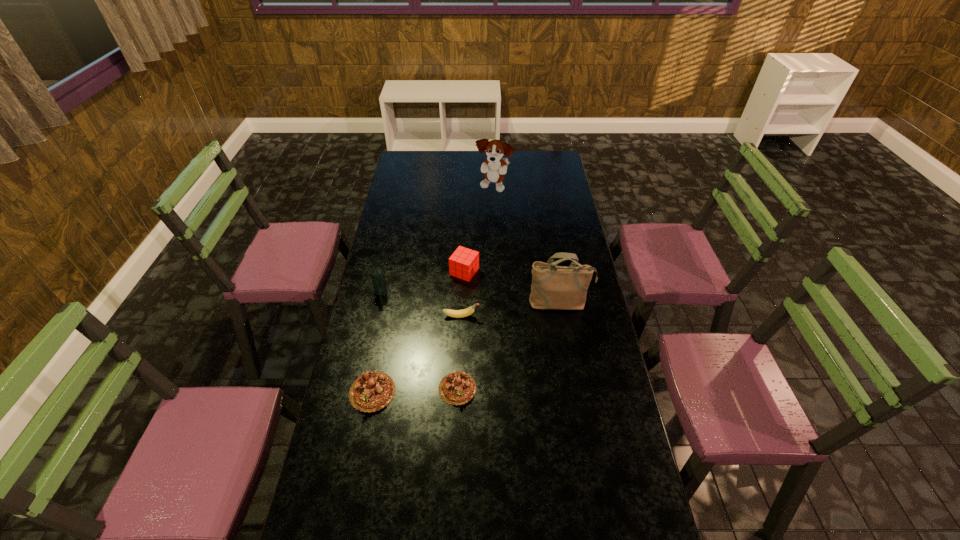
Where is `blank space at the near edge of the desktop`? blank space at the near edge of the desktop is located at coordinates (409, 520).

Identify the location of vacant space at the left edge of the desktop. (341, 445).

This screenshot has height=540, width=960. I want to click on vacant space at the right edge of the desktop, so click(539, 175).

Locate an element on the screen. The image size is (960, 540). free spot at the far right corner of the desktop is located at coordinates (551, 166).

Locate an element on the screen. The image size is (960, 540). empty location between the banana and the rightmost object is located at coordinates (511, 310).

Locate an element on the screen. This screenshot has height=540, width=960. vacant area that lies between the shorter chocolate cake and the shoulder bag is located at coordinates (509, 346).

The image size is (960, 540). I want to click on blank region between the fourth shortest object and the rightmost object, so click(x=513, y=287).

Locate an element on the screen. The image size is (960, 540). free space between the farthest object and the banana is located at coordinates pyautogui.click(x=477, y=252).

Identify the location of blank region between the fourth tallest object and the puppy. The height and width of the screenshot is (540, 960). (479, 230).

Identify the location of unoccupied area between the fourth shortest object and the farthest object. (479, 230).